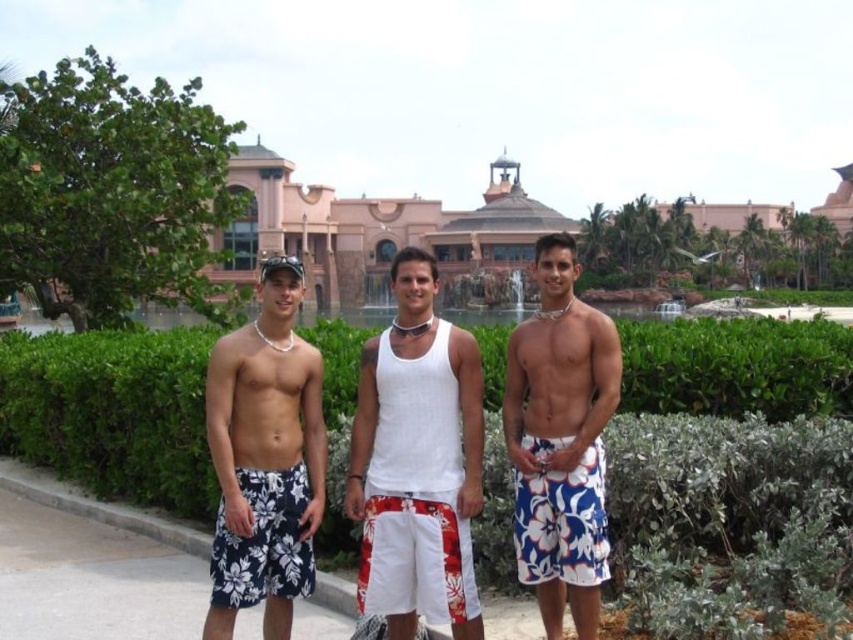
You are a photographer trying to capture a photo of the matte white shorts at center. The camera you are using has a focal length of 50mm. If the shorts are at point 0.717 on the x axis and 0.312 on the y axis, what coordinates should you focus on to ensure the shorts are in the center of the photo?

The coordinates to focus on are 0.717 on the x axis and 0.312 on the y axis, as that is where the matte white shorts at center are located.